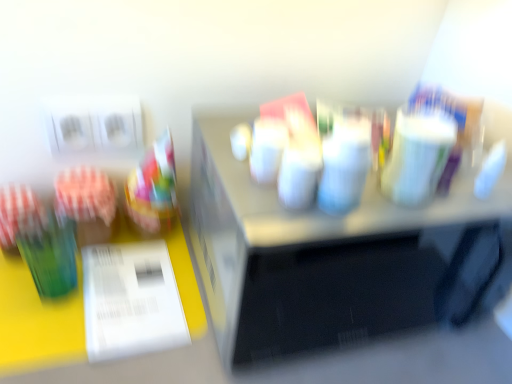
Question: Is metallic silver microwave at center further to camera compared to white glossy paper at lower left?

Choices:
 (A) yes
 (B) no

Answer: (B)

Question: Is metallic silver microwave at center at the right side of white glossy paper at lower left?

Choices:
 (A) yes
 (B) no

Answer: (A)

Question: Would you say metallic silver microwave at center is outside white glossy paper at lower left?

Choices:
 (A) no
 (B) yes

Answer: (B)

Question: Is metallic silver microwave at center to the left of white glossy paper at lower left from the viewer's perspective?

Choices:
 (A) yes
 (B) no

Answer: (B)

Question: From a real-world perspective, is metallic silver microwave at center under white glossy paper at lower left?

Choices:
 (A) yes
 (B) no

Answer: (B)

Question: Is green glass at left bigger or smaller than white glossy paper at lower left?

Choices:
 (A) small
 (B) big

Answer: (B)

Question: Considering their positions, is green glass at left located in front of or behind white glossy paper at lower left?

Choices:
 (A) behind
 (B) front

Answer: (A)

Question: Is green glass at left inside or outside of white glossy paper at lower left?

Choices:
 (A) outside
 (B) inside

Answer: (A)

Question: In terms of width, does green glass at left look wider or thinner when compared to white glossy paper at lower left?

Choices:
 (A) wide
 (B) thin

Answer: (B)

Question: From the image's perspective, is green glass at left above or below metallic silver microwave at center?

Choices:
 (A) above
 (B) below

Answer: (A)

Question: Is green glass at left situated inside metallic silver microwave at center or outside?

Choices:
 (A) outside
 (B) inside

Answer: (A)

Question: Is green glass at left in front of or behind metallic silver microwave at center in the image?

Choices:
 (A) behind
 (B) front

Answer: (A)

Question: Looking at their shapes, would you say green glass at left is wider or thinner than metallic silver microwave at center?

Choices:
 (A) wide
 (B) thin

Answer: (B)

Question: Would you say white glossy paper at lower left is to the left or to the right of green glass at left in the picture?

Choices:
 (A) right
 (B) left

Answer: (A)

Question: Looking at their shapes, would you say white glossy paper at lower left is wider or thinner than green glass at left?

Choices:
 (A) thin
 (B) wide

Answer: (B)